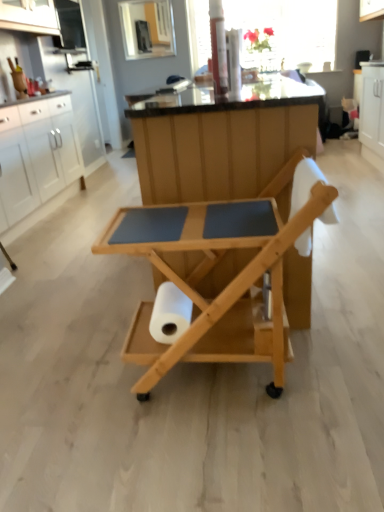
This screenshot has width=384, height=512. In order to click on white matte cabinet at left in this screenshot , I will do `click(36, 160)`.

The width and height of the screenshot is (384, 512). What do you see at coordinates (284, 32) in the screenshot? I see `transparent glass window screen at upper center` at bounding box center [284, 32].

The height and width of the screenshot is (512, 384). Describe the element at coordinates (209, 272) in the screenshot. I see `natural wood rolling cart at center` at that location.

In order to face natural wood rolling cart at center, should I rotate leftwards or rightwards?

It's best to rotate right around 3.128 degrees.

I want to click on white matte cabinet at left, so click(36, 160).

Based on the photo, is natural wood rolling cart at center thinner than transparent glass window screen at upper center?

In fact, natural wood rolling cart at center might be wider than transparent glass window screen at upper center.

Is natural wood rolling cart at center far away from transparent glass window screen at upper center?

Yes, natural wood rolling cart at center and transparent glass window screen at upper center are located far from each other.

Could you tell me if natural wood rolling cart at center is facing transparent glass window screen at upper center?

No.

From the image's perspective, between white matte cabinet at left and transparent glass window screen at upper center, which one is located above?

transparent glass window screen at upper center appears higher in the image.

Between white matte cabinet at left and transparent glass window screen at upper center, which one has smaller size?

white matte cabinet at left is smaller.

From a real-world perspective, between white matte cabinet at left and transparent glass window screen at upper center, who is vertically lower?

white matte cabinet at left is physically lower.

From a real-world perspective, which object rests below the other?

natural wood rolling cart at center.

You are a GUI agent. You are given a task and a screenshot of the screen. Output one action in this format:
    pyautogui.click(x=<x>, y=<y>)
    Task: Click on the table lying below the white matte cabinet at left (from the image's perspective)
    
    Given the screenshot: What is the action you would take?
    pyautogui.click(x=209, y=272)

Between white matte cabinet at left and natural wood rolling cart at center, which one has more height?

white matte cabinet at left is taller.

Is white matte cabinet at left oriented towards natural wood rolling cart at center?

No.

How far apart are natural wood rolling cart at center and white matte cabinet at left?

A distance of 2.04 meters exists between natural wood rolling cart at center and white matte cabinet at left.

The width and height of the screenshot is (384, 512). I want to click on cabinetry above the natural wood rolling cart at center (from the image's perspective), so click(x=36, y=160).

Is natural wood rolling cart at center bigger or smaller than white matte cabinet at left?

Clearly, natural wood rolling cart at center is smaller in size than white matte cabinet at left.

Is natural wood rolling cart at center oriented away from white matte cabinet at left?

No.

Which object is positioned more to the right, white matte paper towel at center or natural wood rolling cart at center?

Positioned to the right is natural wood rolling cart at center.

Is point (167, 300) in front of point (107, 250)?

No, (167, 300) is further to viewer.

Can you confirm if white matte paper towel at center is taller than natural wood rolling cart at center?

No.

Would you say white matte paper towel at center is outside transparent glass window screen at upper center?

Yes.

Considering the relative positions of white matte paper towel at center and transparent glass window screen at upper center in the image provided, is white matte paper towel at center to the left of transparent glass window screen at upper center from the viewer's perspective?

Yes, white matte paper towel at center is to the left of transparent glass window screen at upper center.

From the image's perspective, which is above, white matte paper towel at center or transparent glass window screen at upper center?

From the image's view, transparent glass window screen at upper center is above.

Is white matte paper towel at center wider or thinner than transparent glass window screen at upper center?

Considering their sizes, white matte paper towel at center looks slimmer than transparent glass window screen at upper center.

Does transparent glass window screen at upper center have a larger size compared to white matte paper towel at center?

Yes, transparent glass window screen at upper center is bigger than white matte paper towel at center.

Could you tell me if transparent glass window screen at upper center is facing white matte paper towel at center?

Yes, transparent glass window screen at upper center is facing white matte paper towel at center.

Is white matte paper towel at center completely or partially inside transparent glass window screen at upper center?

Actually, white matte paper towel at center is outside transparent glass window screen at upper center.

Considering the relative positions of transparent glass window screen at upper center and white matte paper towel at center in the image provided, is transparent glass window screen at upper center to the right of white matte paper towel at center from the viewer's perspective?

Indeed, transparent glass window screen at upper center is positioned on the right side of white matte paper towel at center.

Where is `window screen on the right of natural wood rolling cart at center`? Image resolution: width=384 pixels, height=512 pixels. window screen on the right of natural wood rolling cart at center is located at coordinates (284, 32).

Identify the location of window screen above the white matte cabinet at left (from the image's perspective). (284, 32).

When comparing their distances from white matte paper towel at center, does natural wood rolling cart at center or transparent glass window screen at upper center seem further?

The object further to white matte paper towel at center is transparent glass window screen at upper center.

From the image, which object appears to be nearer to natural wood rolling cart at center, white matte paper towel at center or transparent glass window screen at upper center?

Based on the image, white matte paper towel at center appears to be nearer to natural wood rolling cart at center.

From the image, which object appears to be farther from natural wood rolling cart at center, transparent glass window screen at upper center or white matte paper towel at center?

Based on the image, transparent glass window screen at upper center appears to be further to natural wood rolling cart at center.

Considering their positions, is transparent glass window screen at upper center positioned further to white matte cabinet at left than natural wood rolling cart at center?

natural wood rolling cart at center.

Considering their positions, is white matte cabinet at left positioned closer to transparent glass window screen at upper center than natural wood rolling cart at center?

white matte cabinet at left.

Considering their positions, is white matte paper towel at center positioned closer to white matte cabinet at left than natural wood rolling cart at center?

natural wood rolling cart at center is closer to white matte cabinet at left.

Based on their spatial positions, is white matte cabinet at left or white matte paper towel at center closer to transparent glass window screen at upper center?

white matte cabinet at left.

Considering their positions, is white matte paper towel at center positioned further to white matte cabinet at left than transparent glass window screen at upper center?

Among the two, white matte paper towel at center is located further to white matte cabinet at left.

The height and width of the screenshot is (512, 384). Find the location of `cabinetry located between natural wood rolling cart at center and transparent glass window screen at upper center in the depth direction`. cabinetry located between natural wood rolling cart at center and transparent glass window screen at upper center in the depth direction is located at coordinates (36, 160).

Locate an element on the screen. The width and height of the screenshot is (384, 512). cabinetry between white matte paper towel at center and transparent glass window screen at upper center in the front-back direction is located at coordinates (36, 160).

Where is `paper towel between white matte cabinet at left and natural wood rolling cart at center from left to right`? This screenshot has height=512, width=384. paper towel between white matte cabinet at left and natural wood rolling cart at center from left to right is located at coordinates (170, 314).

Locate an element on the screen. This screenshot has height=512, width=384. paper towel between natural wood rolling cart at center and transparent glass window screen at upper center in the front-back direction is located at coordinates pos(170,314).